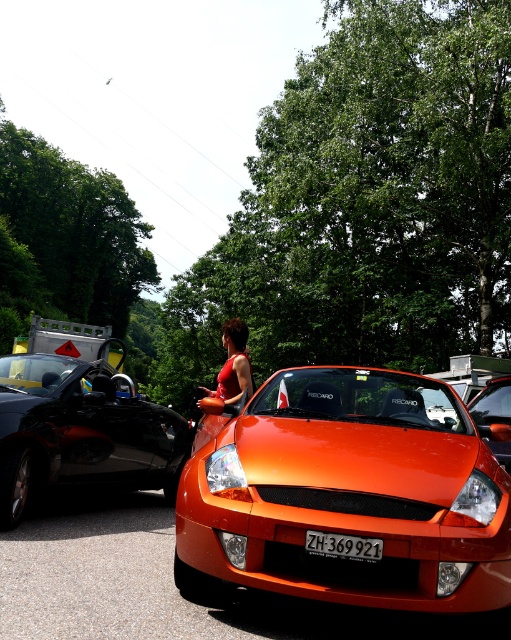
What are the coordinates of the orange matte sports car at center?

The orange matte sports car at center is located at coordinates point (492, 403).